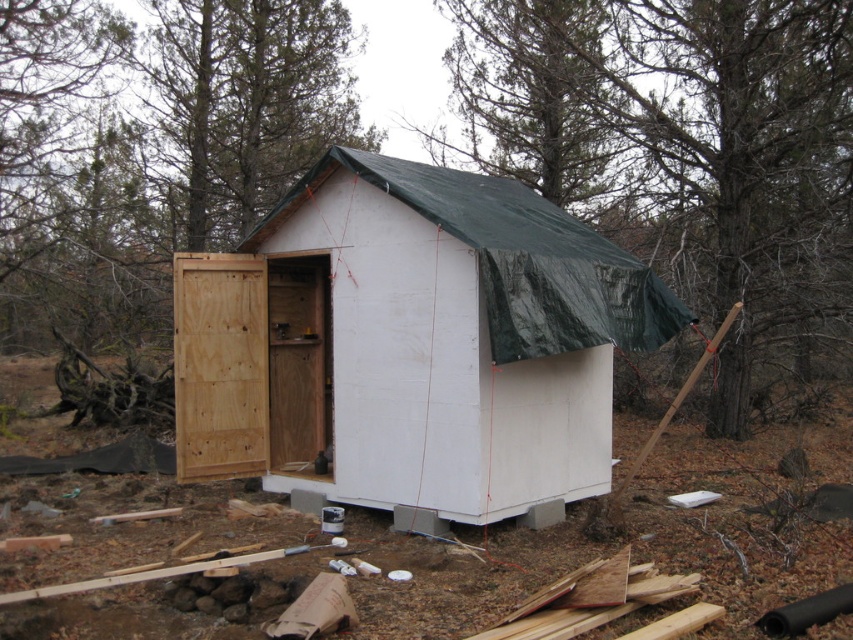
Who is positioned more to the right, white wood cabin at center or green tarp at upper center?

Positioned to the right is green tarp at upper center.

Is white wood cabin at center above green tarp at upper center?

No, white wood cabin at center is not above green tarp at upper center.

Which is in front, point (326, 285) or point (717, 205)?

Point (326, 285) is in front.

The height and width of the screenshot is (640, 853). What are the coordinates of `white wood cabin at center` in the screenshot? It's located at (410, 344).